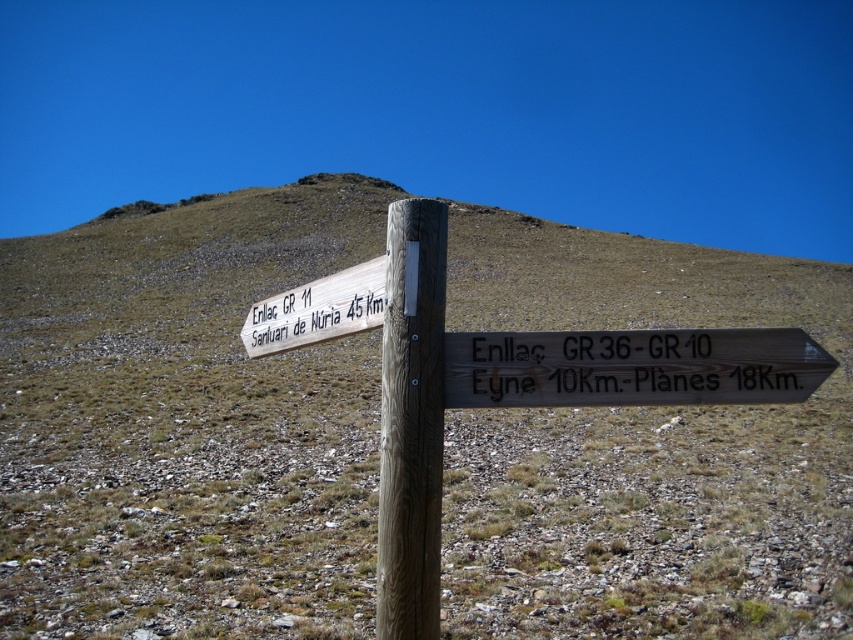
Is wooden signpost at center taller than wooden sign at upper left?

Yes.

Who is positioned more to the left, wooden signpost at center or wooden sign at upper left?

wooden sign at upper left

The height and width of the screenshot is (640, 853). Find the location of `wooden signpost at center`. wooden signpost at center is located at coordinates (546, 422).

Who is positioned more to the left, wooden signpost at center or weathered wood sign at center?

Positioned to the left is wooden signpost at center.

What do you see at coordinates (546, 422) in the screenshot? The height and width of the screenshot is (640, 853). I see `wooden signpost at center` at bounding box center [546, 422].

Image resolution: width=853 pixels, height=640 pixels. Find the location of `wooden signpost at center`. wooden signpost at center is located at coordinates (546, 422).

Consider the image. Who is positioned more to the left, weathered wood sign at center or wooden sign at upper left?

From the viewer's perspective, wooden sign at upper left appears more on the left side.

Based on the photo, can you confirm if weathered wood sign at center is positioned to the left of wooden sign at upper left?

No, weathered wood sign at center is not to the left of wooden sign at upper left.

Identify the location of weathered wood sign at center. (631, 368).